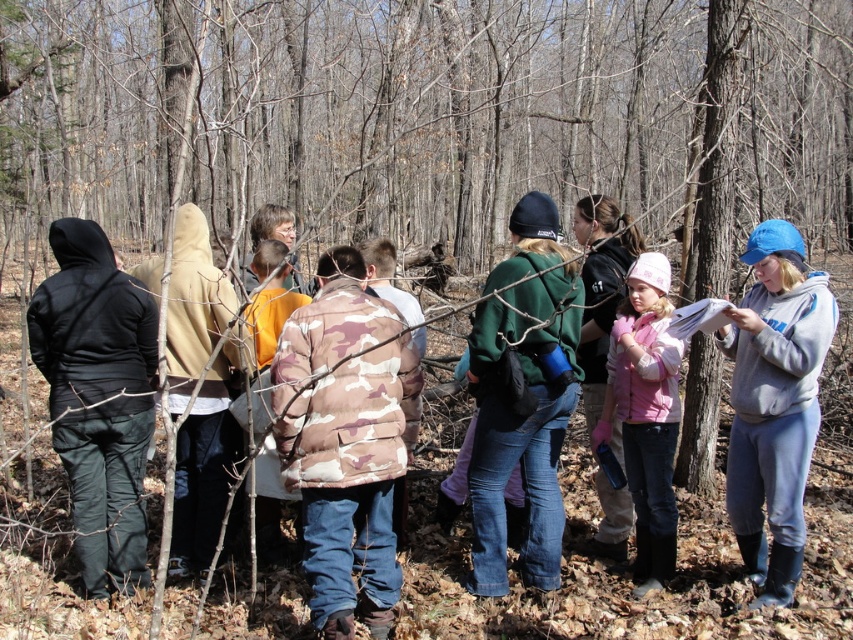
You are standing in the wooded area and want to take a photo of both point (x=775, y=433) and point (x=668, y=346). Since you want both points to be in focus, which point should you focus on?

You should focus on point (x=668, y=346) because it is farther from the camera than point (x=775, y=433). By focusing on the farther point, the closer point will also be within the depth of field, ensuring both are in focus.

You are organizing a group activity and need to ensure everyone has appropriate clothing. Given the gray fleece sweatshirt at right and the pink fleece jacket at center, which one would be more suitable for someone who prefers a roomier fit?

The gray fleece sweatshirt at right has a larger size compared to the pink fleece jacket at center, so it would be more suitable for someone who prefers a roomier fit.

You are part of the group in the wooded area and want to hand a note to the person wearing the pink fleece jacket at center. Which direction should you move relative to the green fleece jacket at center?

The green fleece jacket at center is to the left of the pink fleece jacket at center, so you should move to the right relative to the green fleece jacket at center to reach the pink fleece jacket at center.